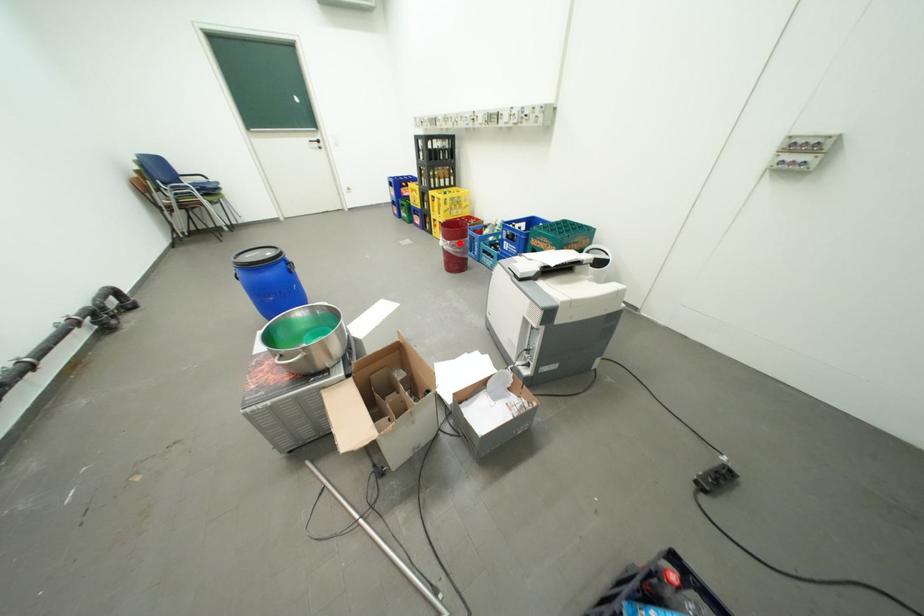
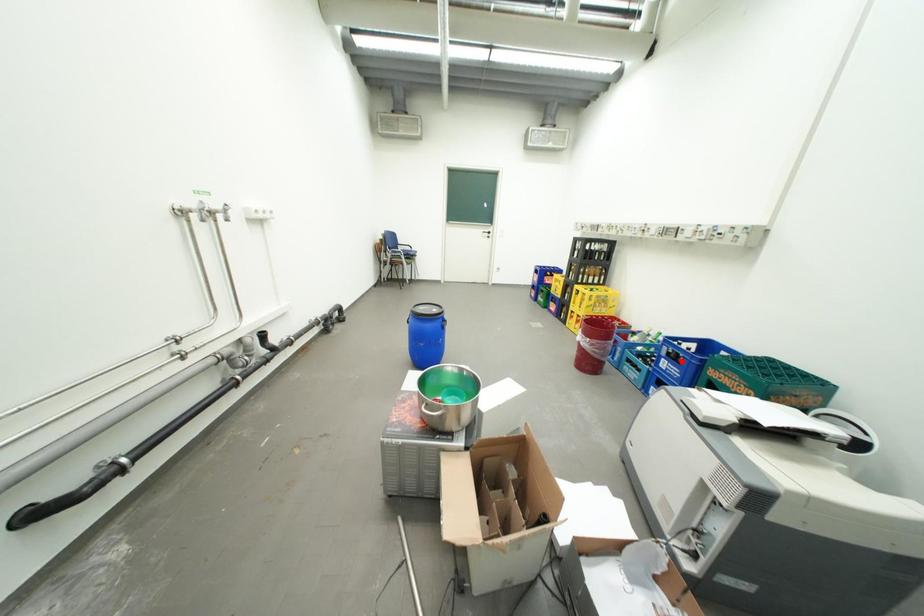
I am providing you with two images of the same scene from different viewpoints. A red point is marked on the first image and another point is marked on the second image. Does the point marked in image1 correspond to the same location as the one in image2?

No